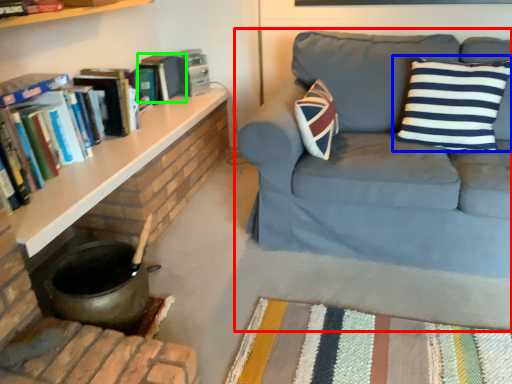
Question: Which object is positioned farthest from studio couch (highlighted by a red box)? Select from pillow (highlighted by a blue box) and paperback book (highlighted by a green box).

Choices:
 (A) pillow
 (B) paperback book

Answer: (B)